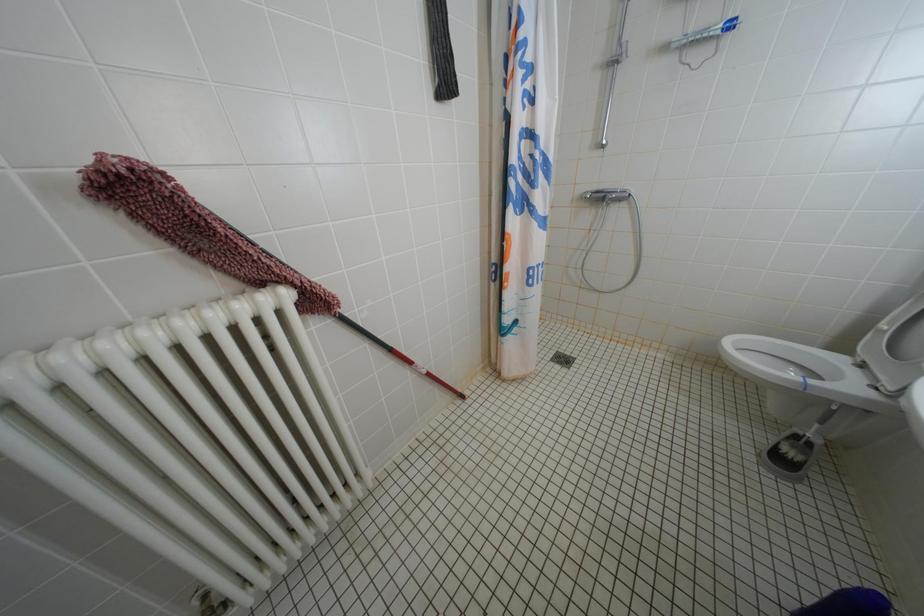
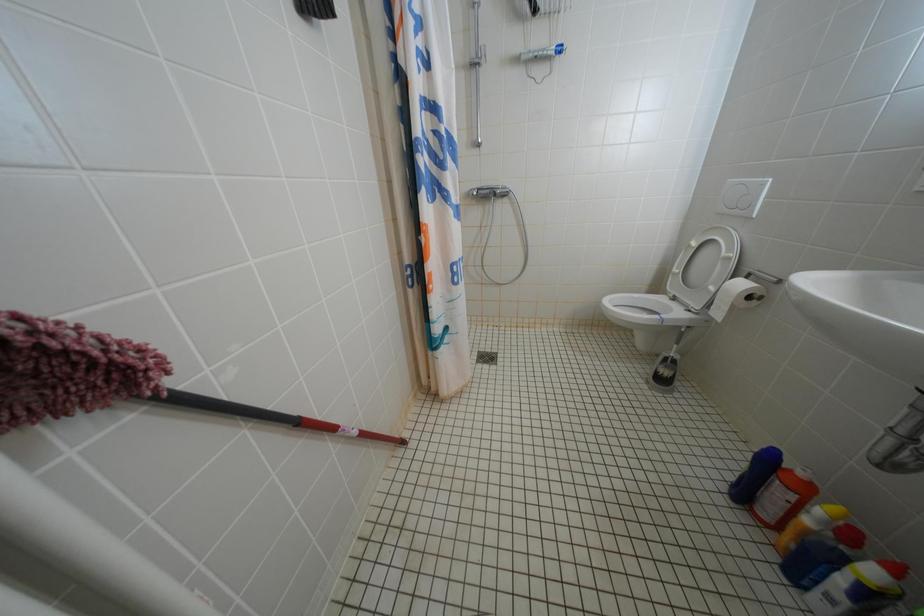
Question: The camera is either moving clockwise (left) or counter-clockwise (right) around the object. The first image is from the beginning of the video and the second image is from the end. Is the camera moving left or right when shooting the video?

Choices:
 (A) Left
 (B) Right

Answer: (A)